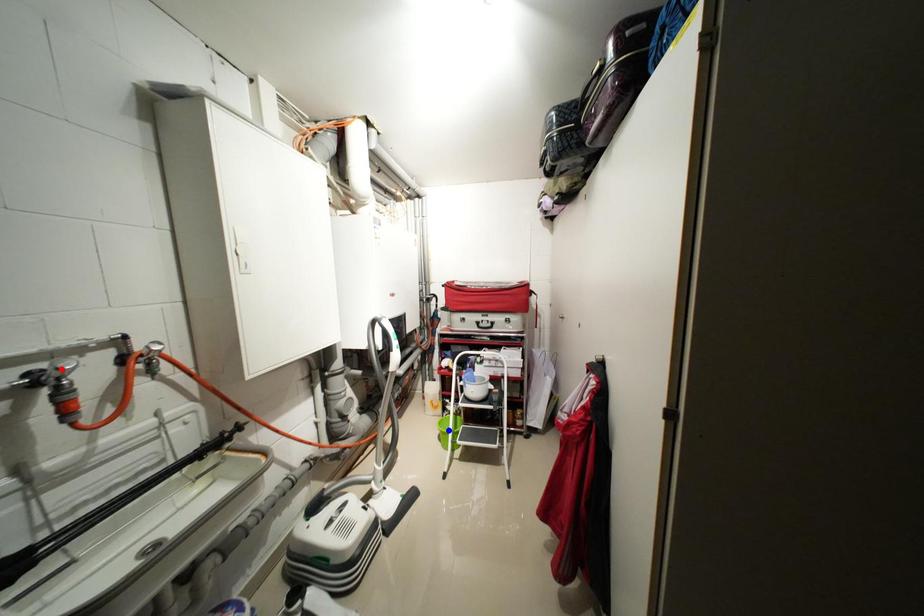
Question: Which of the two points in the image is closer to the camera?

Choices:
 (A) Blue point is closer.
 (B) Red point is closer.

Answer: (B)